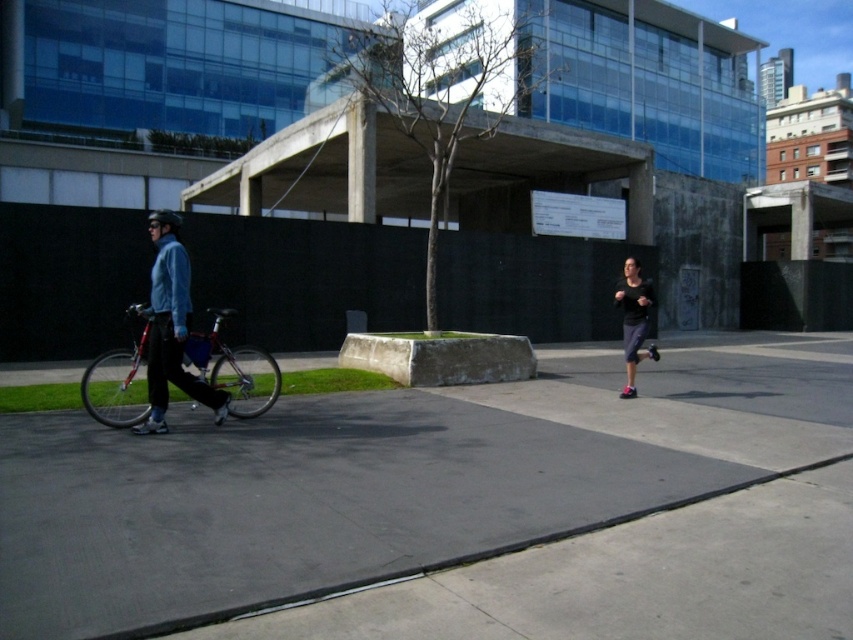
Question: Which object appears farthest from the camera in this image?

Choices:
 (A) matte blue jacket at left
 (B) shiny metallic bicycle at left
 (C) black matte running shoes at right
 (D) gray concrete pavement at center

Answer: (C)

Question: Can you confirm if shiny metallic bicycle at left is bigger than matte blue jacket at left?

Choices:
 (A) no
 (B) yes

Answer: (A)

Question: Based on their relative distances, which object is farther from the shiny metallic bicycle at left?

Choices:
 (A) black matte running shoes at right
 (B) matte blue jacket at left
 (C) gray concrete pavement at center

Answer: (A)

Question: Where is gray concrete pavement at center located in relation to matte blue jacket at left in the image?

Choices:
 (A) right
 (B) left

Answer: (A)

Question: Is the position of shiny metallic bicycle at left less distant than that of black matte running shoes at right?

Choices:
 (A) no
 (B) yes

Answer: (B)

Question: Which point is closer to the camera taking this photo?

Choices:
 (A) (141, 468)
 (B) (160, 374)

Answer: (A)